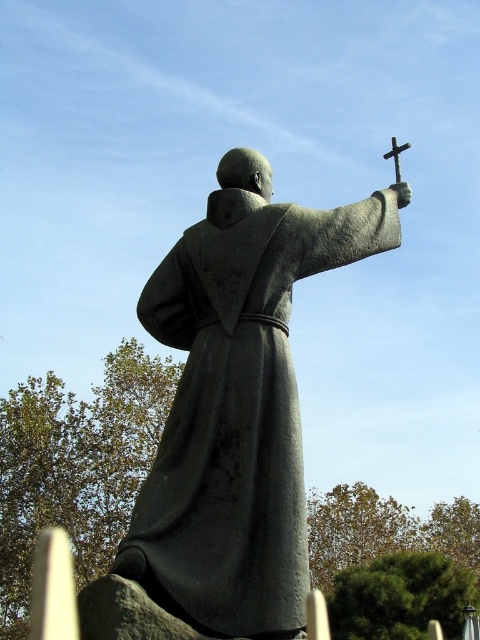
Who is more distant from viewer, (210, 300) or (394, 140)?

Point (394, 140)

Does gray stone statue at center have a greater width compared to polished silver cross at upper right?

Correct, the width of gray stone statue at center exceeds that of polished silver cross at upper right.

What do you see at coordinates (238, 403) in the screenshot? I see `gray stone statue at center` at bounding box center [238, 403].

Identify the location of gray stone statue at center. (238, 403).